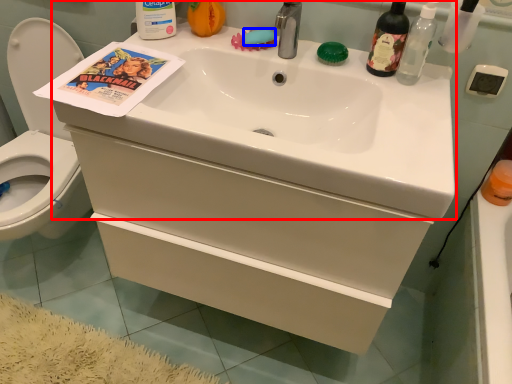
Question: Which object is closer to the camera taking this photo, sink (highlighted by a red box) or soap (highlighted by a blue box)?

Choices:
 (A) sink
 (B) soap

Answer: (A)